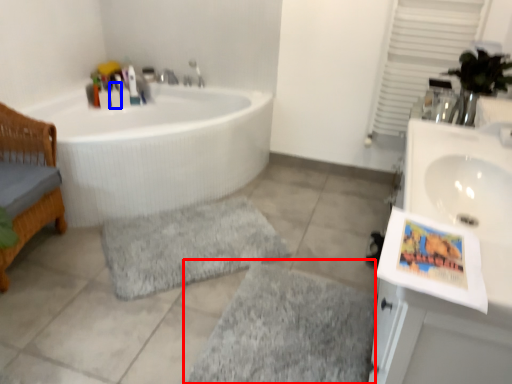
Question: Which object appears closest to the camera in this image, bath mat (highlighted by a red box) or toiletry (highlighted by a blue box)?

Choices:
 (A) bath mat
 (B) toiletry

Answer: (A)